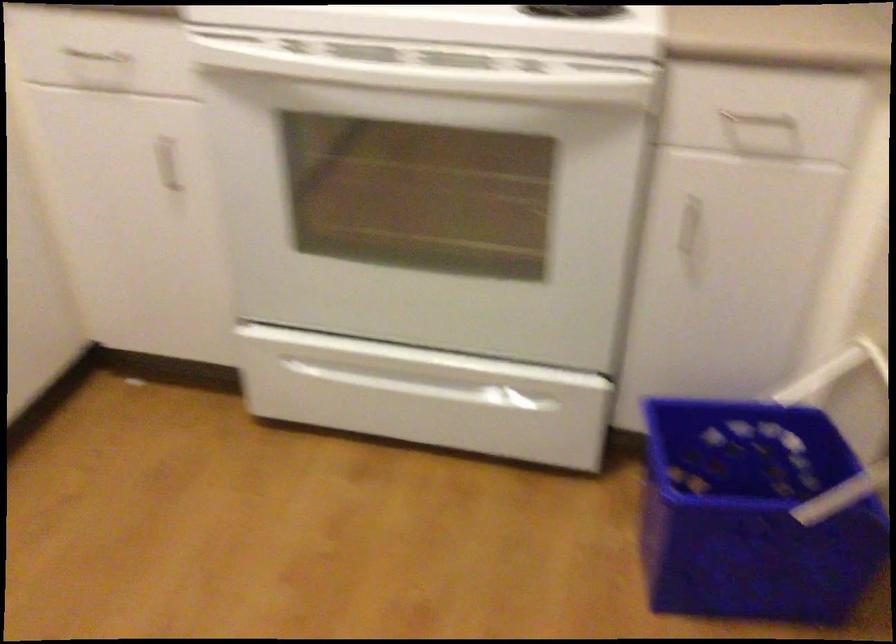
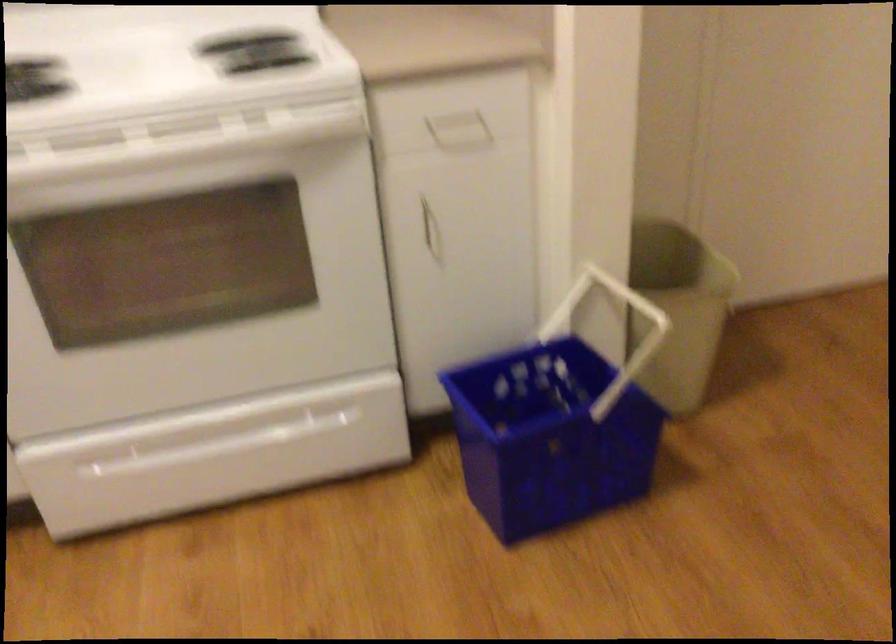
Locate, in the second image, the point that corresponds to (686,245) in the first image.

(431, 234)